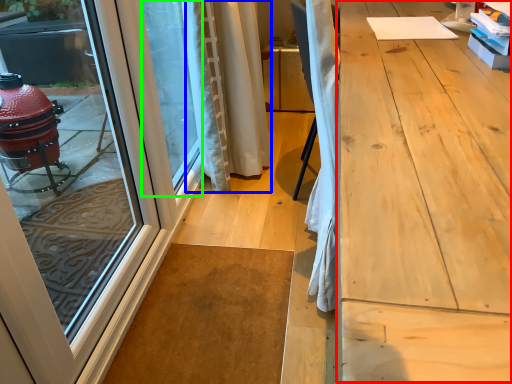
Question: Estimate the real-world distances between objects in this image. Which object is farther from workbench (highlighted by a red box), curtain (highlighted by a blue box) or window screen (highlighted by a green box)?

Choices:
 (A) curtain
 (B) window screen

Answer: (B)